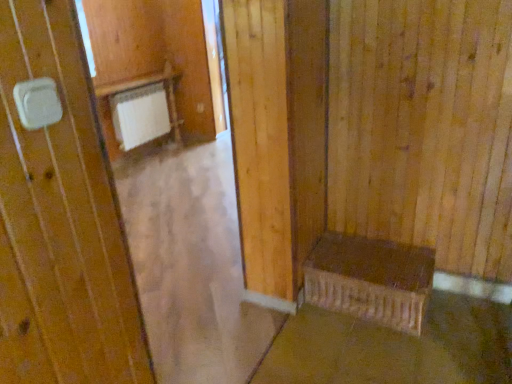
Where is `vacant area in front of brown wooden bench at lower right`? This screenshot has width=512, height=384. vacant area in front of brown wooden bench at lower right is located at coordinates (395, 355).